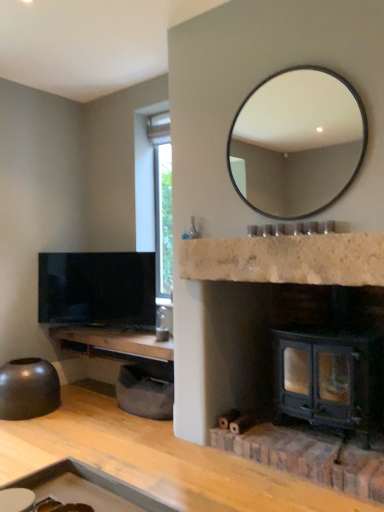
The image size is (384, 512). I want to click on free space in front of matte black bowl at lower left, so click(x=34, y=430).